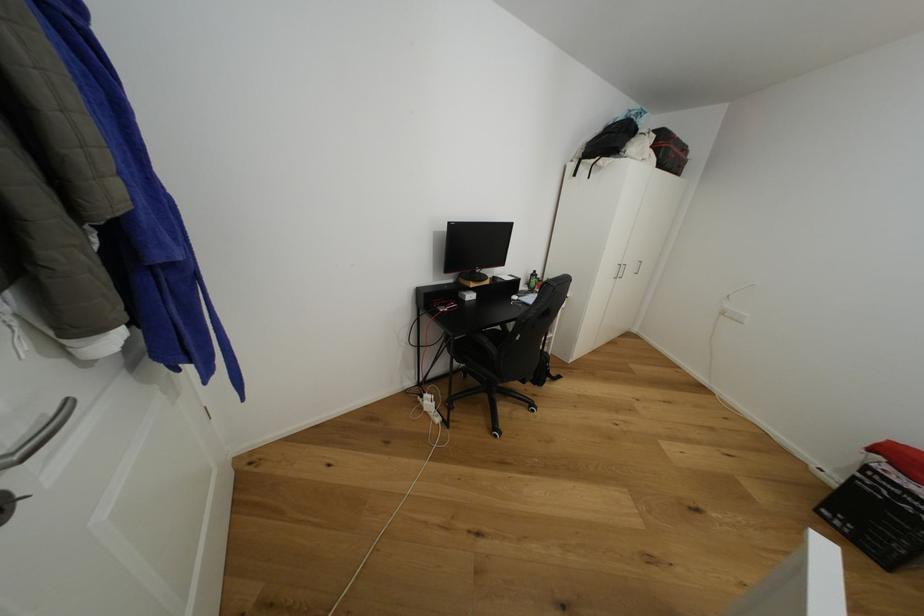
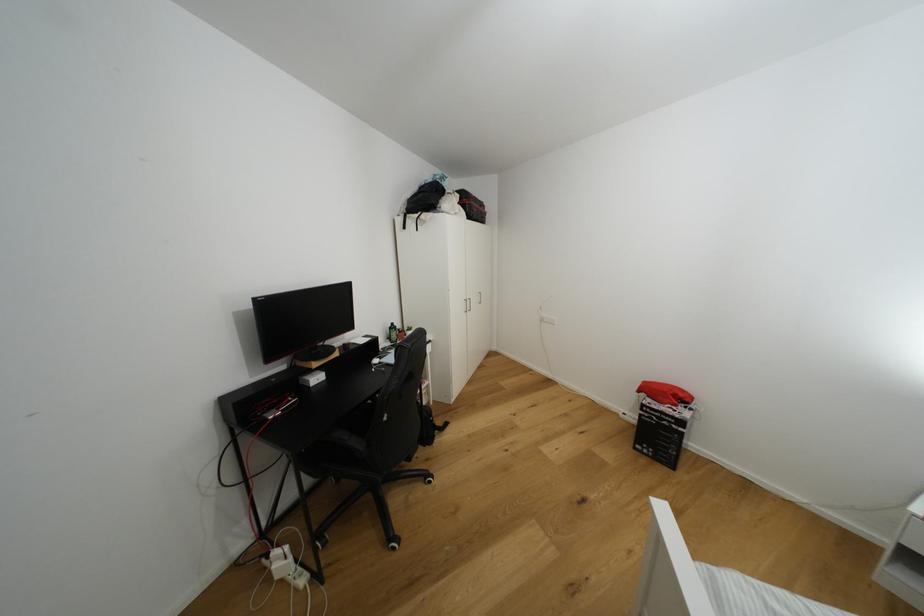
Find the pixel in the second image that matches (x=537, y=277) in the first image.

(395, 330)